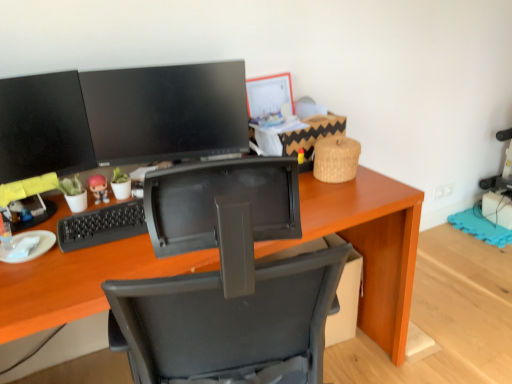
Question: In terms of width, does matte black monitor at upper center, positioned as the first computer monitor in right-to-left order, look wider or thinner when compared to matte plastic figurine at center?

Choices:
 (A) wide
 (B) thin

Answer: (B)

Question: Considering the positions of matte black monitor at upper center, marked as the second computer monitor in a left-to-right arrangement, and matte plastic figurine at center in the image, is matte black monitor at upper center, marked as the second computer monitor in a left-to-right arrangement, taller or shorter than matte plastic figurine at center?

Choices:
 (A) short
 (B) tall

Answer: (B)

Question: Based on their relative distances, which object is nearer to the matte black monitor at upper center, positioned as the first computer monitor in right-to-left order?

Choices:
 (A) wooden desk at center
 (B) matte black monitor at left, which is the 2th computer monitor from right to left
 (C) matte plastic figurine at center

Answer: (B)

Question: Which object is the closest to the matte plastic figurine at center?

Choices:
 (A) wooden desk at center
 (B) matte black monitor at left, which is the 2th computer monitor from right to left
 (C) matte black monitor at upper center, positioned as the first computer monitor in right-to-left order

Answer: (B)